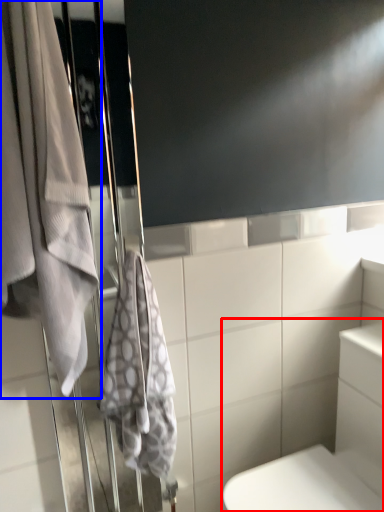
Question: Which object appears farthest to the camera in this image, bath (highlighted by a red box) or towel (highlighted by a blue box)?

Choices:
 (A) bath
 (B) towel

Answer: (A)